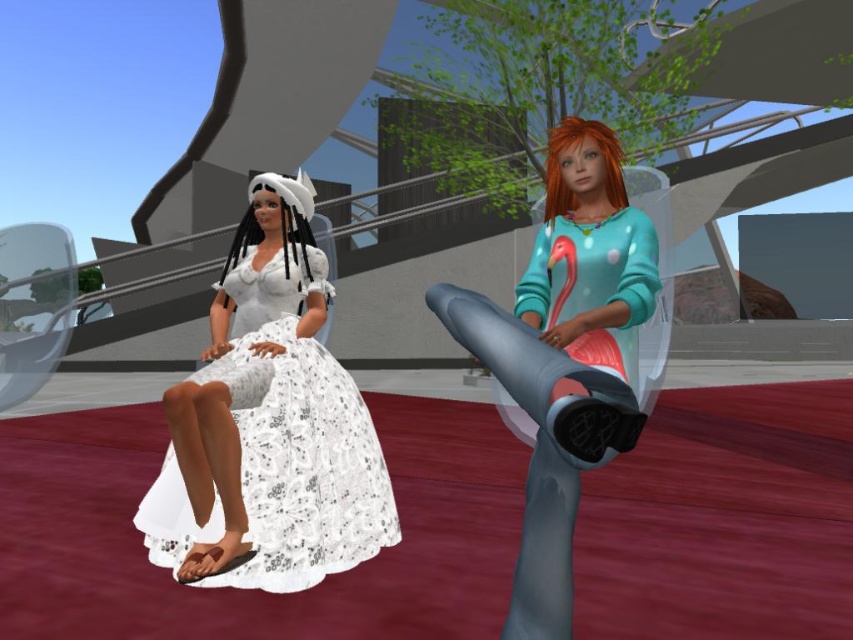
Question: Considering the relative positions of white lace dress at left and teal matte sweater at center in the image provided, where is white lace dress at left located with respect to teal matte sweater at center?

Choices:
 (A) left
 (B) right

Answer: (A)

Question: Which point is closer to the camera?

Choices:
 (A) (550, 492)
 (B) (341, 387)

Answer: (A)

Question: Is white lace dress at left bigger than teal matte sweater at center?

Choices:
 (A) no
 (B) yes

Answer: (B)

Question: Is white lace dress at left above teal matte sweater at center?

Choices:
 (A) yes
 (B) no

Answer: (B)

Question: Which point is closer to the camera?

Choices:
 (A) (598, 301)
 (B) (331, 355)

Answer: (A)